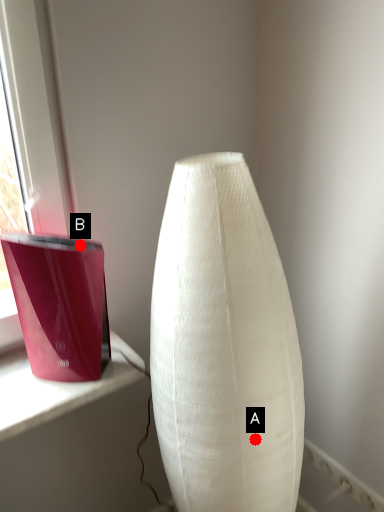
Question: Two points are circled on the image, labeled by A and B beside each circle. Which point is further to the camera?

Choices:
 (A) A is further
 (B) B is further

Answer: (B)